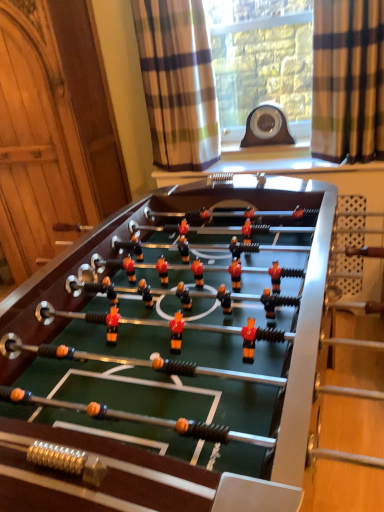
Question: Does green felt table at center have a larger size compared to brown plaid curtain at upper right, placed as the 2th curtain when sorted from left to right?

Choices:
 (A) no
 (B) yes

Answer: (B)

Question: Is green felt table at center looking in the opposite direction of brown plaid curtain at upper right, which is the first curtain in right-to-left order?

Choices:
 (A) yes
 (B) no

Answer: (B)

Question: From a real-world perspective, is green felt table at center located beneath brown plaid curtain at upper right, which is the first curtain in right-to-left order?

Choices:
 (A) no
 (B) yes

Answer: (B)

Question: Is the position of green felt table at center more distant than that of brown plaid curtain at upper right, which is the first curtain in right-to-left order?

Choices:
 (A) yes
 (B) no

Answer: (B)

Question: Considering the relative positions of green felt table at center and brown plaid curtain at upper right, placed as the 2th curtain when sorted from left to right, in the image provided, is green felt table at center in front of brown plaid curtain at upper right, placed as the 2th curtain when sorted from left to right,?

Choices:
 (A) yes
 (B) no

Answer: (A)

Question: Can we say green felt table at center lies outside brown plaid curtain at upper right, placed as the 2th curtain when sorted from left to right?

Choices:
 (A) yes
 (B) no

Answer: (A)

Question: Is brown plaid curtain at upper right, placed as the 2th curtain when sorted from left to right, bigger than plaid fabric curtain at upper center, arranged as the 2th curtain when viewed from the right?

Choices:
 (A) no
 (B) yes

Answer: (A)

Question: From a real-world perspective, is brown plaid curtain at upper right, placed as the 2th curtain when sorted from left to right, located higher than plaid fabric curtain at upper center, arranged as the 2th curtain when viewed from the right?

Choices:
 (A) yes
 (B) no

Answer: (B)

Question: Is brown plaid curtain at upper right, which is the first curtain in right-to-left order, looking in the opposite direction of plaid fabric curtain at upper center, the first curtain viewed from the left?

Choices:
 (A) no
 (B) yes

Answer: (A)

Question: From the image's perspective, does brown plaid curtain at upper right, which is the first curtain in right-to-left order, appear lower than plaid fabric curtain at upper center, the first curtain viewed from the left?

Choices:
 (A) yes
 (B) no

Answer: (A)

Question: From a real-world perspective, is brown plaid curtain at upper right, placed as the 2th curtain when sorted from left to right, under plaid fabric curtain at upper center, arranged as the 2th curtain when viewed from the right?

Choices:
 (A) no
 (B) yes

Answer: (B)

Question: Is brown plaid curtain at upper right, which is the first curtain in right-to-left order, thinner than plaid fabric curtain at upper center, arranged as the 2th curtain when viewed from the right?

Choices:
 (A) no
 (B) yes

Answer: (B)

Question: Could you tell me if plaid fabric curtain at upper center, arranged as the 2th curtain when viewed from the right, is facing green felt table at center?

Choices:
 (A) no
 (B) yes

Answer: (B)